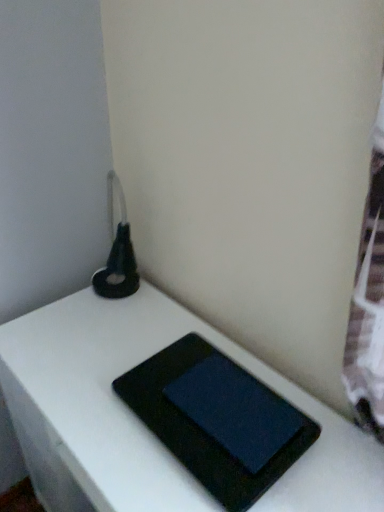
Question: Is matte black tablet at center, acting as the 2th tablet computer starting from the bottom, to the right of black matte book at center from the viewer's perspective?

Choices:
 (A) no
 (B) yes

Answer: (B)

Question: Is matte black tablet at center, which ranks as the 1th tablet computer in top-to-bottom order, to the left of black matte book at center from the viewer's perspective?

Choices:
 (A) yes
 (B) no

Answer: (B)

Question: Can you confirm if matte black tablet at center, acting as the 2th tablet computer starting from the bottom, is bigger than black matte book at center?

Choices:
 (A) no
 (B) yes

Answer: (A)

Question: Does matte black tablet at center, which ranks as the 1th tablet computer in top-to-bottom order, come behind black matte book at center?

Choices:
 (A) yes
 (B) no

Answer: (A)

Question: Can you confirm if matte black tablet at center, which ranks as the 1th tablet computer in top-to-bottom order, is taller than black matte book at center?

Choices:
 (A) yes
 (B) no

Answer: (B)

Question: Would you say black matte book at center is inside or outside matte black tablet at center, acting as the 2th tablet computer starting from the bottom?

Choices:
 (A) inside
 (B) outside

Answer: (B)

Question: Visually, is black matte book at center positioned to the left or to the right of matte black tablet at center, acting as the 2th tablet computer starting from the bottom?

Choices:
 (A) left
 (B) right

Answer: (A)

Question: Considering the positions of black matte book at center and matte black tablet at center, acting as the 2th tablet computer starting from the bottom, in the image, is black matte book at center taller or shorter than matte black tablet at center, acting as the 2th tablet computer starting from the bottom,?

Choices:
 (A) tall
 (B) short

Answer: (A)

Question: From a real-world perspective, is black matte book at center above or below matte black tablet at center, acting as the 2th tablet computer starting from the bottom?

Choices:
 (A) above
 (B) below

Answer: (B)

Question: Considering the positions of point (200, 373) and point (367, 496), is point (200, 373) closer or farther from the camera than point (367, 496)?

Choices:
 (A) closer
 (B) farther

Answer: (B)

Question: Is matte black tablet at center, which ranks as the 1th tablet computer in top-to-bottom order, spatially inside black matte book at center, or outside of it?

Choices:
 (A) inside
 (B) outside

Answer: (B)

Question: Is matte black tablet at center, which ranks as the 1th tablet computer in top-to-bottom order, wider or thinner than black matte book at center?

Choices:
 (A) thin
 (B) wide

Answer: (A)

Question: In the image, is matte black tablet at center, which ranks as the 1th tablet computer in top-to-bottom order, on the left side or the right side of black matte book at center?

Choices:
 (A) left
 (B) right

Answer: (B)

Question: Considering the relative positions of black matte tablet at center, placed as the 1th tablet computer when sorted from bottom to top, and matte black tablet at center, which ranks as the 1th tablet computer in top-to-bottom order, in the image provided, is black matte tablet at center, placed as the 1th tablet computer when sorted from bottom to top, to the left or to the right of matte black tablet at center, which ranks as the 1th tablet computer in top-to-bottom order,?

Choices:
 (A) right
 (B) left

Answer: (B)

Question: Is black matte tablet at center, the 2th tablet computer in the top-to-bottom sequence, inside or outside of matte black tablet at center, which ranks as the 1th tablet computer in top-to-bottom order?

Choices:
 (A) outside
 (B) inside

Answer: (A)